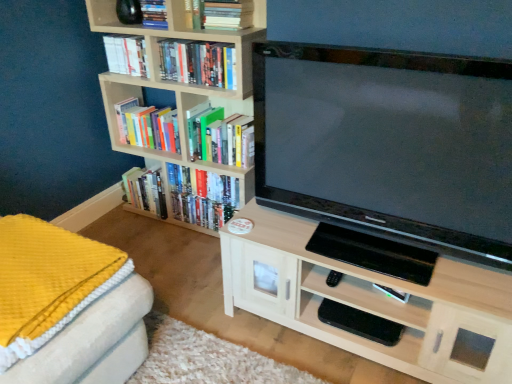
Locate an element on the screen. vacant space underneath matte black tv at center (from a real-world perspective) is located at coordinates (369, 252).